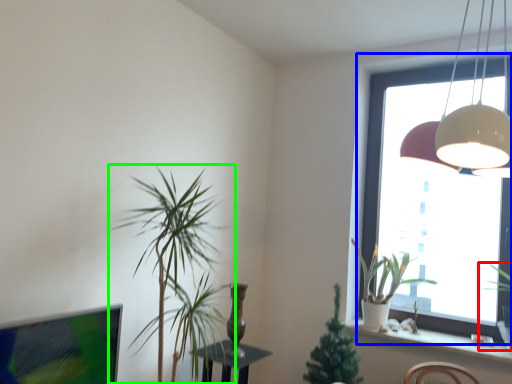
Question: Which object is positioned closest to houseplant (highlighted by a red box)? Select from window (highlighted by a blue box) and houseplant (highlighted by a green box).

Choices:
 (A) window
 (B) houseplant

Answer: (A)